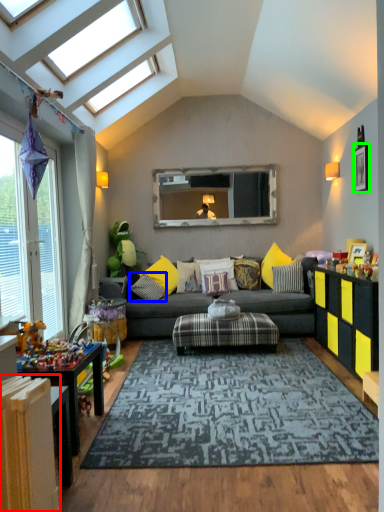
Question: Which object is the closest to the radiator (highlighted by a red box)? Choose among these: pillow (highlighted by a blue box) or picture frame (highlighted by a green box).

Choices:
 (A) pillow
 (B) picture frame

Answer: (A)